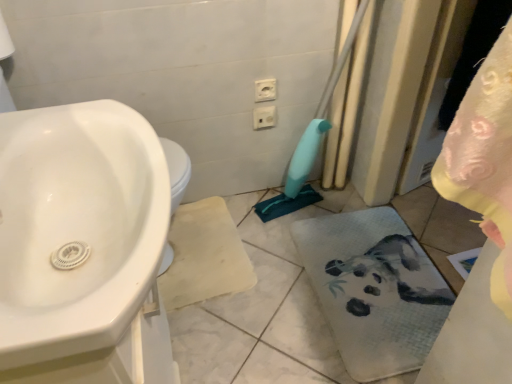
Question: Should I look upward or downward to see white fabric bath towel at lower right?

Choices:
 (A) down
 (B) up

Answer: (A)

Question: Does white glossy sink at left appear on the left side of white fabric bath towel at lower right?

Choices:
 (A) no
 (B) yes

Answer: (B)

Question: Is white fabric bath towel at lower right surrounded by white glossy sink at left?

Choices:
 (A) no
 (B) yes

Answer: (A)

Question: Is white glossy sink at left looking in the opposite direction of white fabric bath towel at lower right?

Choices:
 (A) yes
 (B) no

Answer: (B)

Question: Is white glossy sink at left placed right next to white fabric bath towel at lower right?

Choices:
 (A) yes
 (B) no

Answer: (B)

Question: From a real-world perspective, is white glossy sink at left positioned under white fabric bath towel at lower right based on gravity?

Choices:
 (A) no
 (B) yes

Answer: (A)

Question: Considering the relative positions of white glossy sink at left and white fabric bath towel at lower right in the image provided, is white glossy sink at left behind white fabric bath towel at lower right?

Choices:
 (A) no
 (B) yes

Answer: (A)

Question: Is white glossy sink at left bigger than white plastic electric outlet at upper center, which appears as the 1th electric outlet when viewed from the top?

Choices:
 (A) no
 (B) yes

Answer: (B)

Question: Can you confirm if white glossy sink at left is positioned to the right of white plastic electric outlet at upper center, which appears as the 1th electric outlet when viewed from the top?

Choices:
 (A) no
 (B) yes

Answer: (A)

Question: Considering the relative sizes of white glossy sink at left and white plastic electric outlet at upper center, which appears as the 1th electric outlet when viewed from the top, in the image provided, is white glossy sink at left shorter than white plastic electric outlet at upper center, which appears as the 1th electric outlet when viewed from the top,?

Choices:
 (A) yes
 (B) no

Answer: (B)

Question: Is white glossy sink at left not within white plastic electric outlet at upper center, the first electric outlet viewed from the front?

Choices:
 (A) yes
 (B) no

Answer: (A)

Question: Is white glossy sink at left oriented away from white plastic electric outlet at upper center, the 2th electric outlet from the bottom?

Choices:
 (A) yes
 (B) no

Answer: (B)

Question: Is white glossy sink at left not close to white plastic electric outlet at upper center, the 2th electric outlet from the bottom?

Choices:
 (A) yes
 (B) no

Answer: (B)

Question: Is white glossy sink at left closer to camera compared to white plastic electric outlet at upper center, positioned as the 1th electric outlet in back-to-front order?

Choices:
 (A) no
 (B) yes

Answer: (B)